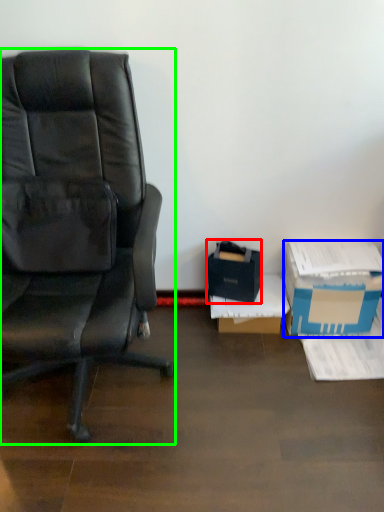
Question: Estimate the real-world distances between objects in this image. Which object is farther from box (highlighted by a red box), box (highlighted by a blue box) or chair (highlighted by a green box)?

Choices:
 (A) box
 (B) chair

Answer: (B)